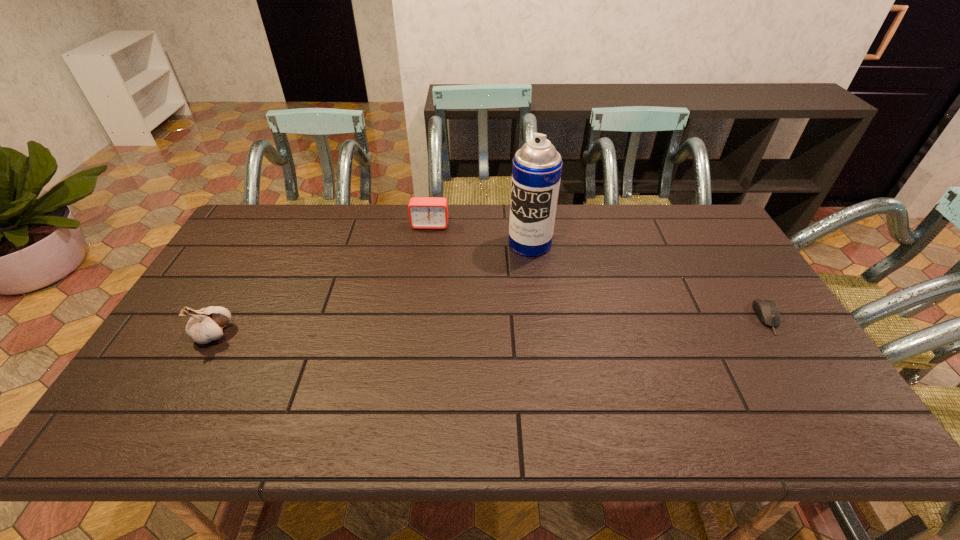
In order to click on free space located 0.390m on the label side of the third object from left to right in this screenshot , I will do `click(458, 340)`.

Image resolution: width=960 pixels, height=540 pixels. What are the coordinates of `vacant space located 0.160m on the label side of the third object from left to right` in the screenshot? It's located at (498, 287).

You are a GUI agent. You are given a task and a screenshot of the screen. Output one action in this format:
    pyautogui.click(x=<x>, y=<y>)
    Task: Click on the free spot located on the label side of the third object from left to right
    This screenshot has height=540, width=960.
    Given the screenshot: What is the action you would take?
    pyautogui.click(x=494, y=291)

I want to click on vacant point located on the front-facing side of the farthest object, so click(x=416, y=313).

At what (x,y) coordinates should I click in order to perform the action: click on free space located on the front-facing side of the farthest object. Please return your answer as a coordinate pair (x, y). The height and width of the screenshot is (540, 960). Looking at the image, I should click on (417, 307).

At what (x,y) coordinates should I click in order to perform the action: click on vacant space located on the front-facing side of the farthest object. Please return your answer as a coordinate pair (x, y). The height and width of the screenshot is (540, 960). Looking at the image, I should click on (420, 285).

Find the location of `aerosol can that is positioned at the far edge`. aerosol can that is positioned at the far edge is located at coordinates (536, 171).

The height and width of the screenshot is (540, 960). I want to click on alarm clock at the far edge, so click(424, 212).

The image size is (960, 540). I want to click on object present at the left edge, so click(206, 324).

Image resolution: width=960 pixels, height=540 pixels. I want to click on object that is at the right edge, so click(x=766, y=310).